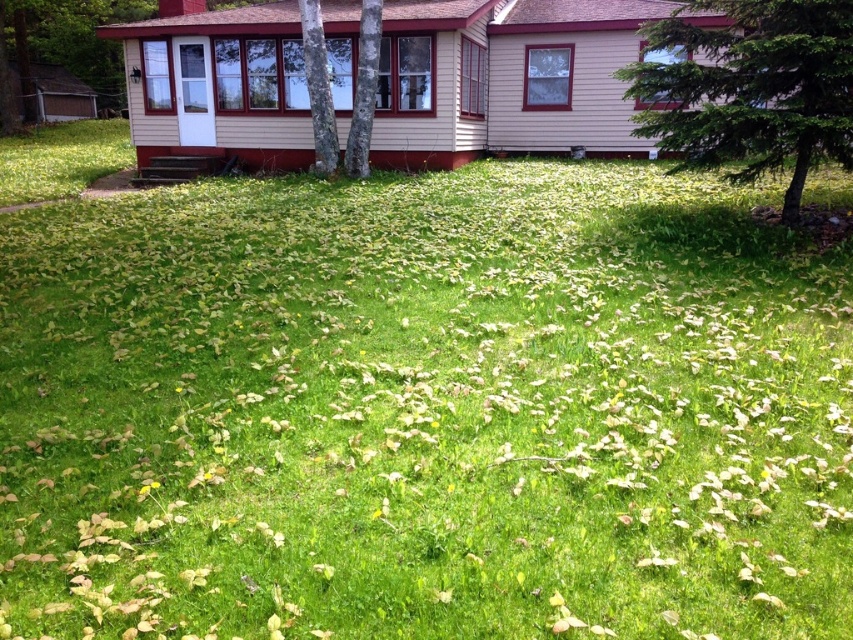
Who is shorter, smooth bark tree at center or smooth gray bark at center?

With less height is smooth bark tree at center.

Where is `smooth bark tree at center`? This screenshot has width=853, height=640. smooth bark tree at center is located at coordinates (318, 88).

This screenshot has width=853, height=640. Find the location of `smooth bark tree at center`. smooth bark tree at center is located at coordinates (318, 88).

The width and height of the screenshot is (853, 640). Describe the element at coordinates (750, 88) in the screenshot. I see `green leafy tree at center` at that location.

Is green leafy tree at center taller than smooth gray bark at center?

No, green leafy tree at center is not taller than smooth gray bark at center.

The image size is (853, 640). In order to click on green leafy tree at center in this screenshot , I will do `click(750, 88)`.

Locate an element on the screen. green leafy tree at center is located at coordinates (750, 88).

Between green leafy tree at center and smooth bark tree at center, which one appears on the right side from the viewer's perspective?

From the viewer's perspective, green leafy tree at center appears more on the right side.

Between point (775, 22) and point (332, 100), which one is positioned behind?

The point (332, 100) is more distant.

Where is `green leafy tree at center`? The width and height of the screenshot is (853, 640). green leafy tree at center is located at coordinates (750, 88).